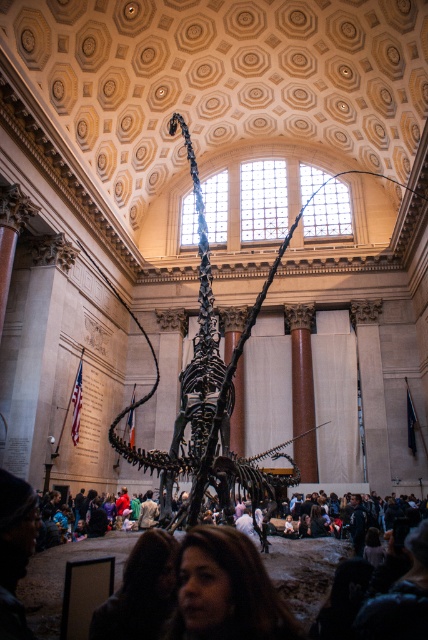
You are a tour guide leading a group of visitors in the grand classical building. You notice a person with brown hair at lower center and a dark clothing crowd at center. Can you safely walk between them to reach the information desk behind the crowd?

The distance between the brown hair at lower center and the dark clothing crowd at center is 8.88 meters, so yes, you can safely walk between them to reach the information desk behind the crowd.